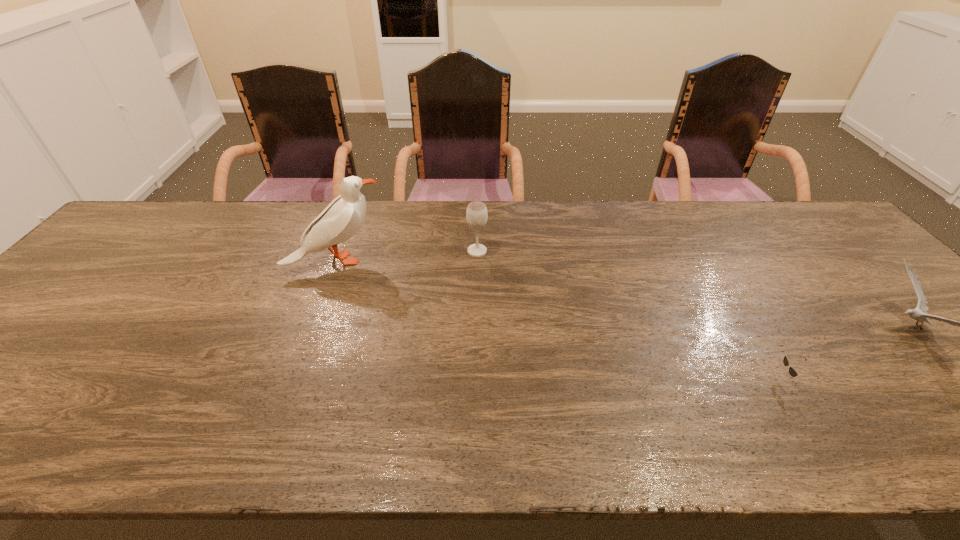
Find the location of a particular element. This screenshot has height=540, width=960. free spot located in front of the lenses of the second object from right to left is located at coordinates (737, 379).

At what (x,y) coordinates should I click in order to perform the action: click on gull situated at the far edge. Please return your answer as a coordinate pair (x, y). Looking at the image, I should click on (343, 217).

Identify the location of wineglass positioned at the far edge. The height and width of the screenshot is (540, 960). (476, 214).

Image resolution: width=960 pixels, height=540 pixels. In the image, there is a desktop. Find the location of `vacant space at the far edge`. vacant space at the far edge is located at coordinates (399, 204).

The image size is (960, 540). I want to click on vacant space at the near edge of the desktop, so click(622, 424).

Locate an element on the screen. unoccupied area between the taller gull and the second object from left to right is located at coordinates (407, 256).

Identify the location of free space between the second tallest object and the shortest object. (635, 315).

Image resolution: width=960 pixels, height=540 pixels. Find the location of `vacant area that lies between the wineglass and the farther gull`. vacant area that lies between the wineglass and the farther gull is located at coordinates pyautogui.click(x=407, y=256).

Where is `vacant area that lies between the third object from left to right and the wineglass`? Image resolution: width=960 pixels, height=540 pixels. vacant area that lies between the third object from left to right and the wineglass is located at coordinates tap(635, 315).

Where is `blank region between the wineglass and the leftmost object`? Image resolution: width=960 pixels, height=540 pixels. blank region between the wineglass and the leftmost object is located at coordinates (407, 256).